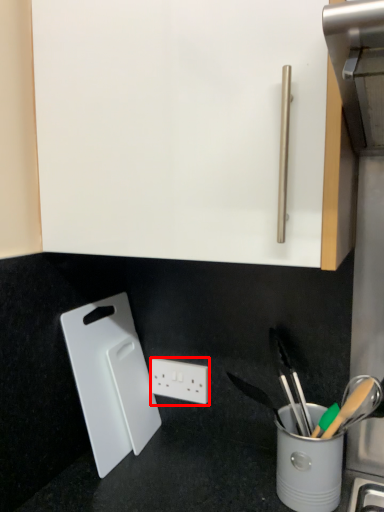
Question: From the image's perspective, what is the correct spatial positioning of power plugs and sockets (annotated by the red box) in reference to cutting board?

Choices:
 (A) above
 (B) below

Answer: (B)